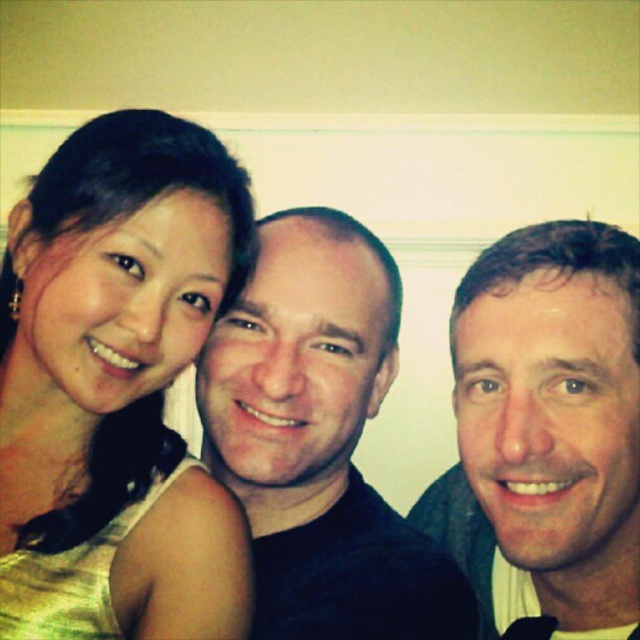
Is point (180, 163) behind point (573, 257)?

Yes, point (180, 163) is behind point (573, 257).

The image size is (640, 640). What do you see at coordinates (116, 387) in the screenshot?
I see `matte gold dress at left` at bounding box center [116, 387].

Is point (64, 556) more distant than point (460, 422)?

That is False.

Find the location of a particular element. Image resolution: width=640 pixels, height=640 pixels. matte gold dress at left is located at coordinates (116, 387).

Between smooth skin face at right and matte black shirt at center, which one has more height?

smooth skin face at right is taller.

Between smooth skin face at right and matte black shirt at center, which one is positioned lower?

smooth skin face at right

Is point (486, 385) closer to viewer compared to point (244, 392)?

Yes, point (486, 385) is closer to viewer.

Where is `smooth skin face at right`? The width and height of the screenshot is (640, 640). smooth skin face at right is located at coordinates (547, 433).

Between matte gold dress at left and matte black shirt at center, which one has more height?

matte gold dress at left is taller.

What do you see at coordinates (116, 387) in the screenshot? I see `matte gold dress at left` at bounding box center [116, 387].

The width and height of the screenshot is (640, 640). Describe the element at coordinates (116, 387) in the screenshot. I see `matte gold dress at left` at that location.

This screenshot has width=640, height=640. In order to click on matte gold dress at left in this screenshot , I will do `click(116, 387)`.